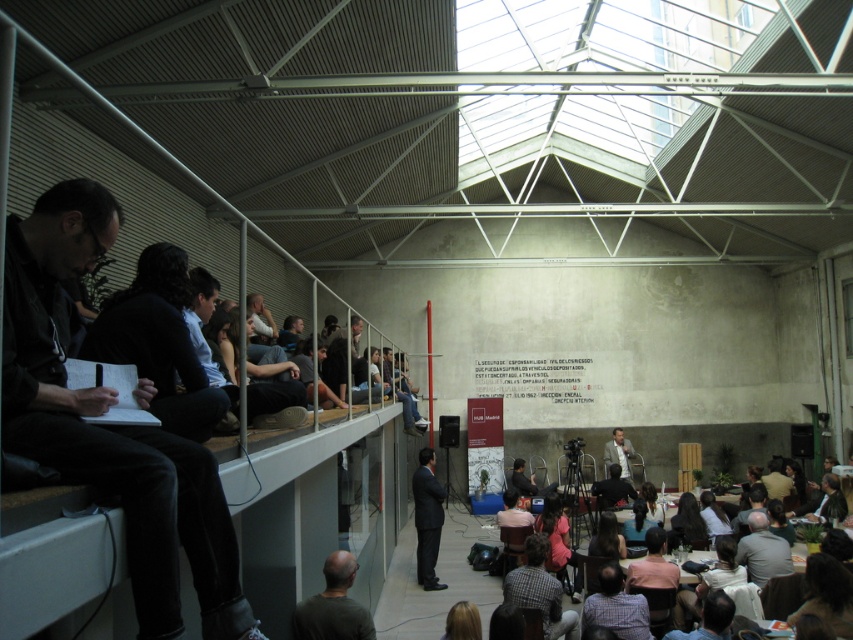
Who is shorter, dark brown fabric chairs at lower center or dark green shirt at lower center?

Standing shorter between the two is dark green shirt at lower center.

Who is lower down, dark brown fabric chairs at lower center or dark green shirt at lower center?

dark brown fabric chairs at lower center

What are the coordinates of `dark brown fabric chairs at lower center` in the screenshot? It's located at (838, 602).

Who is lower down, dark brown fabric chairs at lower center or checkered shirt at lower center?

Positioned lower is checkered shirt at lower center.

Can you confirm if dark brown fabric chairs at lower center is positioned to the left of checkered shirt at lower center?

In fact, dark brown fabric chairs at lower center is to the right of checkered shirt at lower center.

You are a GUI agent. You are given a task and a screenshot of the screen. Output one action in this format:
    pyautogui.click(x=<x>, y=<y>)
    Task: Click on the dark brown fabric chairs at lower center
    
    Given the screenshot: What is the action you would take?
    pyautogui.click(x=838, y=602)

Where is `dark brown fabric chairs at lower center`? Image resolution: width=853 pixels, height=640 pixels. dark brown fabric chairs at lower center is located at coordinates (838, 602).

Between plaid shirt at lower center and dark suit at center, which one is positioned higher?

Positioned higher is plaid shirt at lower center.

Can you confirm if plaid shirt at lower center is bigger than dark suit at center?

Yes.

In order to click on plaid shirt at lower center in this screenshot , I will do `click(540, 589)`.